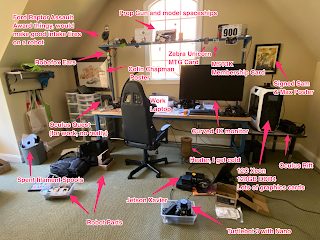
The image size is (320, 240). Find the location of `the right armrest of office chair`. the right armrest of office chair is located at coordinates (164, 129).